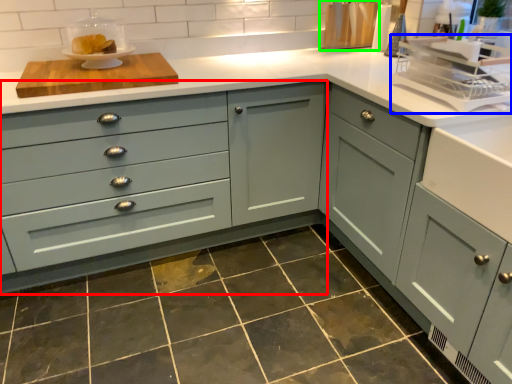
Question: Considering the real-world distances, which object is farthest from cabinetry (highlighted by a red box)? appliance (highlighted by a blue box) or appliance (highlighted by a green box)?

Choices:
 (A) appliance
 (B) appliance

Answer: (B)